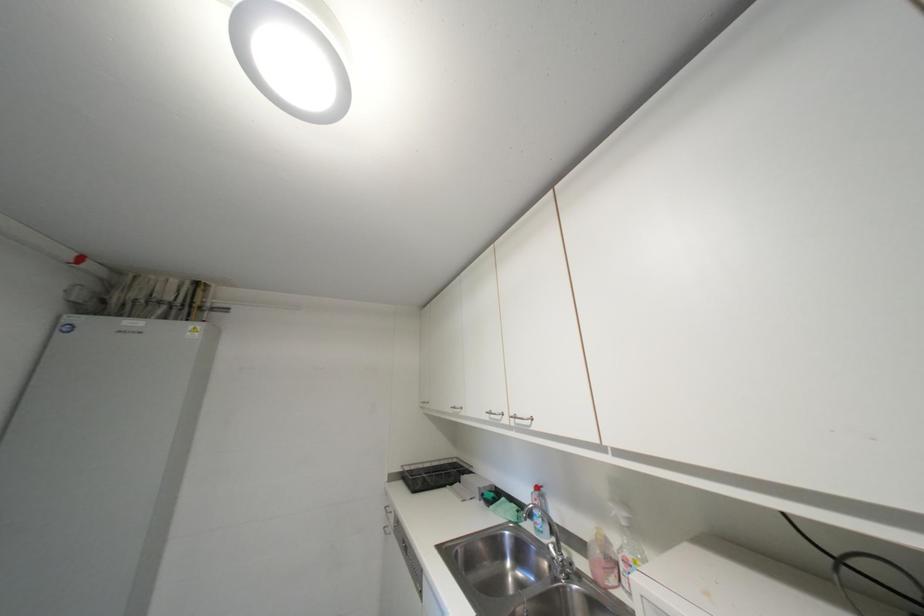
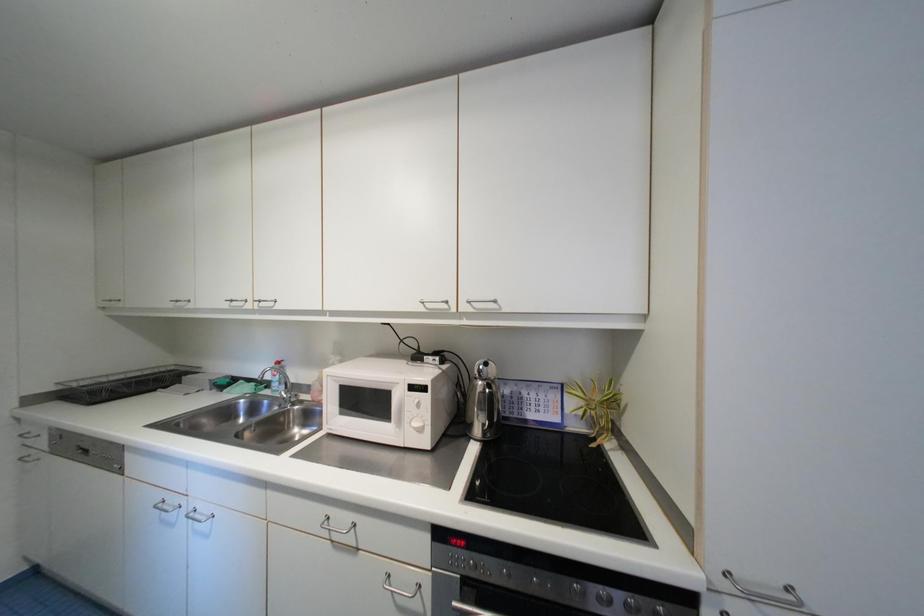
Question: Based on the continuous images, in which direction is the camera rotating? Reply with the corresponding letter.

Choices:
 (A) Left
 (B) Right
 (C) Up
 (D) Down

Answer: (B)